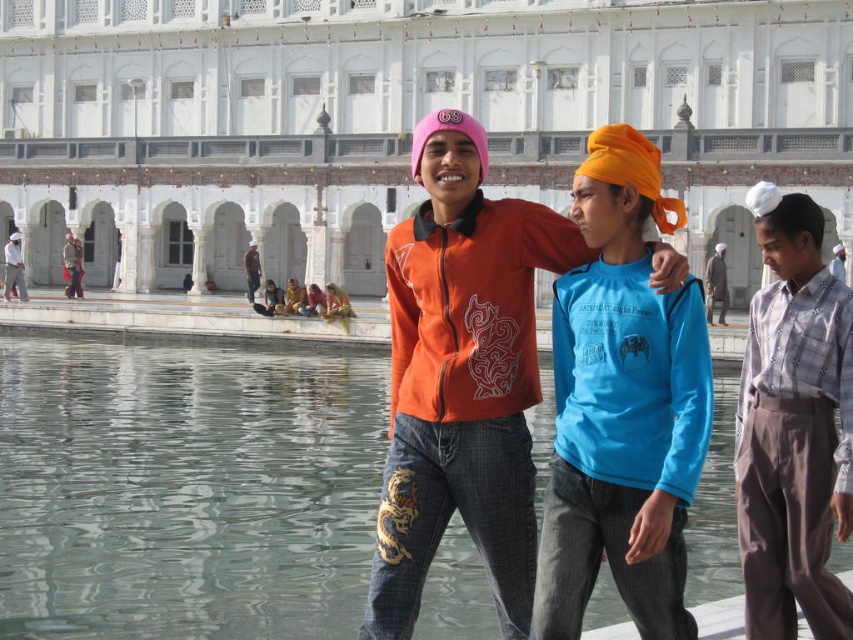
Is orange fabric turban at center smaller than golden fabric sari at center?

Actually, orange fabric turban at center might be larger than golden fabric sari at center.

Measure the distance between orange fabric turban at center and camera.

The distance of orange fabric turban at center from camera is 72.91 feet.

The height and width of the screenshot is (640, 853). In order to click on orange fabric turban at center in this screenshot , I will do `click(631, 170)`.

Does blue fabric shirt at center appear on the right side of white cotton hat at left?

Correct, you'll find blue fabric shirt at center to the right of white cotton hat at left.

The width and height of the screenshot is (853, 640). What do you see at coordinates (622, 404) in the screenshot?
I see `blue fabric shirt at center` at bounding box center [622, 404].

What are the coordinates of `blue fabric shirt at center` in the screenshot? It's located at (622, 404).

Does matte black turban at center have a greater width compared to light pink fabric headscarf at center?

Yes.

Which is above, matte black turban at center or light pink fabric headscarf at center?

matte black turban at center is above.

The height and width of the screenshot is (640, 853). Identify the location of matte black turban at center. (73, 266).